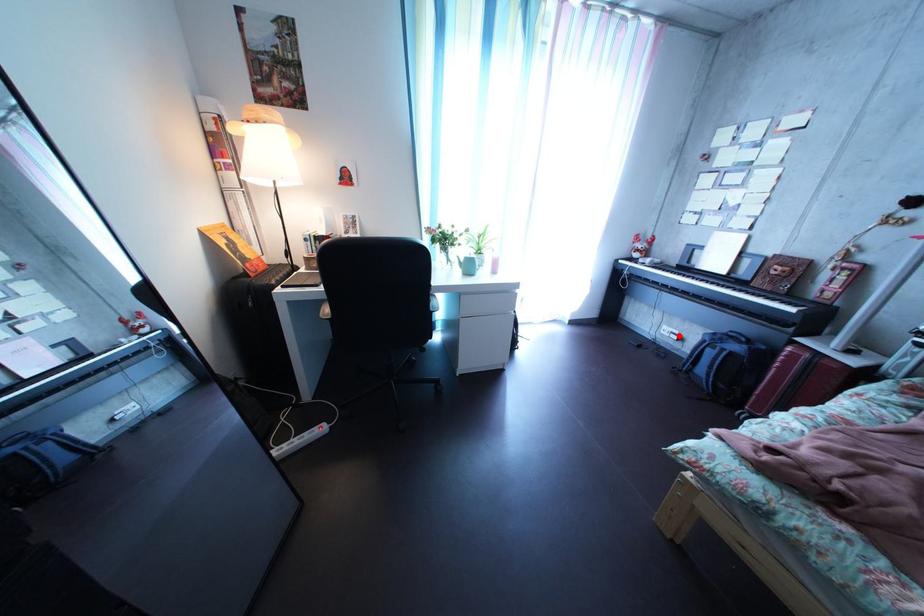
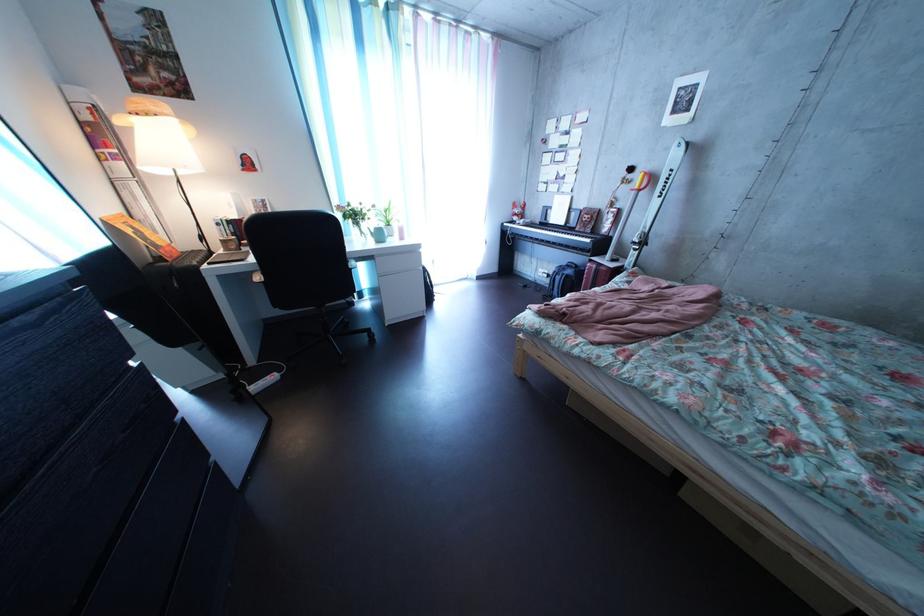
Question: I am providing you with two images of the same scene from different viewpoints. A red point is shown in image1. For the corresponding object point in image2, is it positioned nearer or farther from the camera?

Choices:
 (A) Nearer
 (B) Farther

Answer: (A)